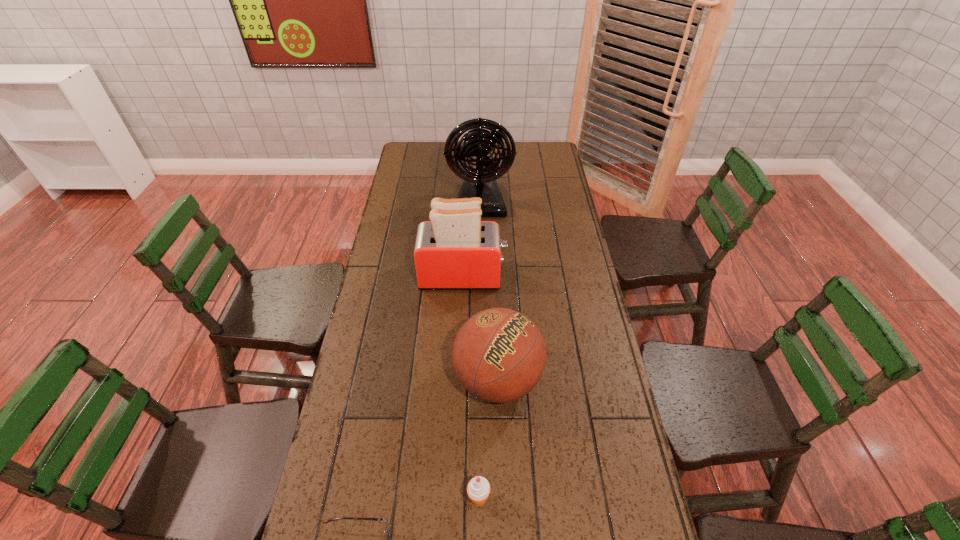
Where is `vacant region that satisfies the following two spatial constraints: 1. on the front-facing side of the second tallest object; 2. on the left side of the third tallest object`? The image size is (960, 540). vacant region that satisfies the following two spatial constraints: 1. on the front-facing side of the second tallest object; 2. on the left side of the third tallest object is located at coordinates (459, 380).

Where is `vacant space that satisfies the following two spatial constraints: 1. on the back side of the third farthest object; 2. on the front-facing side of the fourth nearest object`? vacant space that satisfies the following two spatial constraints: 1. on the back side of the third farthest object; 2. on the front-facing side of the fourth nearest object is located at coordinates (494, 276).

Where is `free point that satisfies the following two spatial constraints: 1. on the front-facing side of the second tallest object; 2. on the left side of the third shortest object`? Image resolution: width=960 pixels, height=540 pixels. free point that satisfies the following two spatial constraints: 1. on the front-facing side of the second tallest object; 2. on the left side of the third shortest object is located at coordinates coord(459,380).

This screenshot has height=540, width=960. I want to click on free space that satisfies the following two spatial constraints: 1. in front of the fan to blow air; 2. on the left side of the third tallest object, so click(x=480, y=380).

Where is `free spot that satisfies the following two spatial constraints: 1. on the front-facing side of the third shortest object; 2. on the left side of the second farthest object`? The height and width of the screenshot is (540, 960). free spot that satisfies the following two spatial constraints: 1. on the front-facing side of the third shortest object; 2. on the left side of the second farthest object is located at coordinates (459, 380).

This screenshot has width=960, height=540. I want to click on free space that satisfies the following two spatial constraints: 1. on the front-facing side of the fourth shortest object; 2. on the right side of the second nearest object, so click(455, 499).